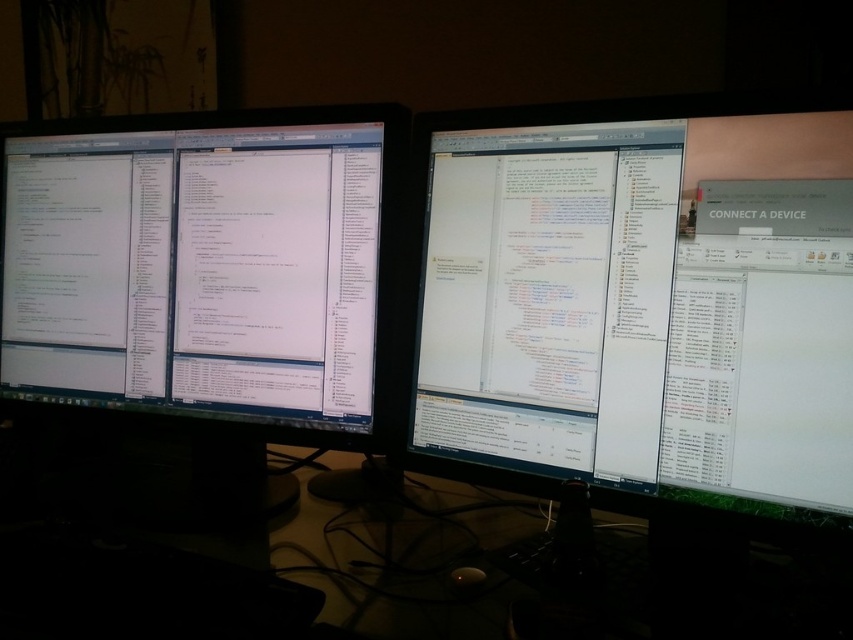
From the picture: You are a developer trying to reach the point at coordinates (526, 410) on the left monitor. If your hand can extend 30 inches from your body, can you comfortably reach that point?

The point at coordinates (526, 410) is 30.28 inches away from the viewer. Since your hand can only extend 30 inches, you cannot comfortably reach that point.

Based on the photo, you are setting up a new monitor stand. The white glossy monitor at center is much taller than the black glass computer desk at center. Which one requires a taller stand to accommodate its height?

The white glossy monitor at center requires a taller stand because it is much taller than the black glass computer desk at center.